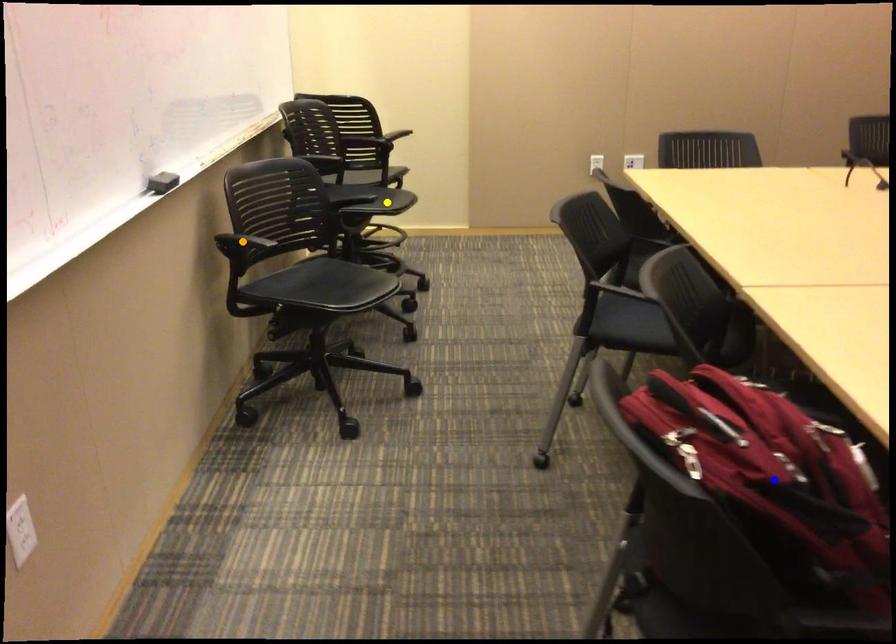
Order these from nearest to farthest:
1. blue point
2. yellow point
3. orange point

blue point → orange point → yellow point